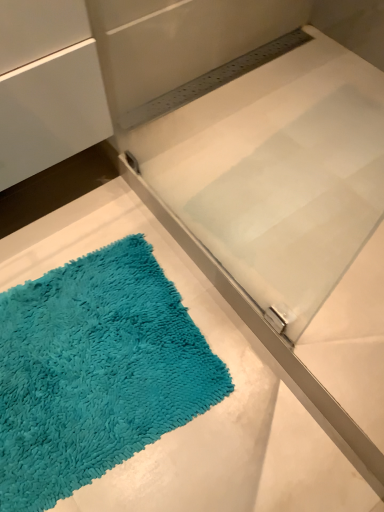
The width and height of the screenshot is (384, 512). What do you see at coordinates (95, 371) in the screenshot? I see `turquoise shaggy bath mat at lower left` at bounding box center [95, 371].

Image resolution: width=384 pixels, height=512 pixels. Identify the location of turquoise shaggy bath mat at lower left. (95, 371).

What is the approximate height of turquoise shaggy bath mat at lower left?

turquoise shaggy bath mat at lower left is 1.62 inches in height.

Locate an element on the screen. The height and width of the screenshot is (512, 384). turquoise shaggy bath mat at lower left is located at coordinates (95, 371).